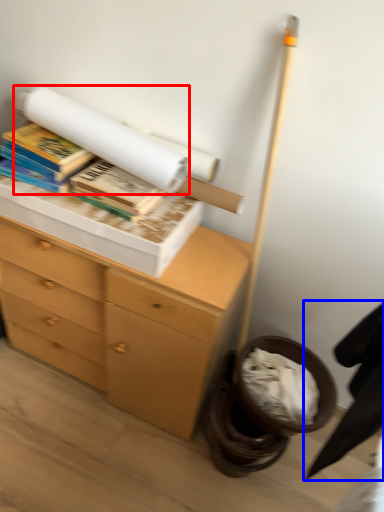
Question: Which point is closer to the camera, book (highlighted by a red box) or swivel chair (highlighted by a blue box)?

Choices:
 (A) book
 (B) swivel chair

Answer: (B)